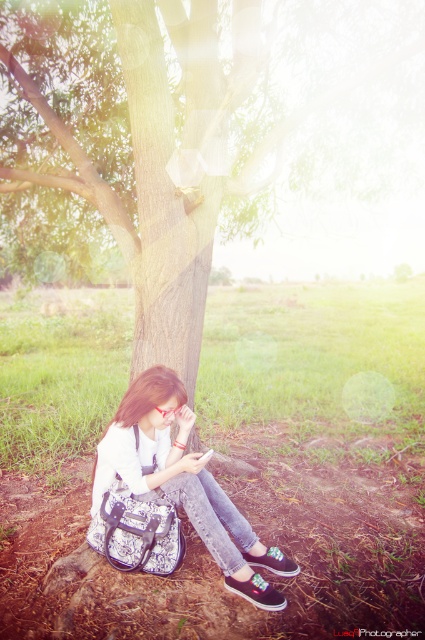
You are standing at the point marked by the coordinates point (167, 492) and want to move towards the woman. Which direction should you go?

The white textured bag at lower center is represented by point (167, 492). Since the woman is seated under a large tree in a grassy field, you should move in the direction away from the bag towards the tree to reach her.

You are a photographer trying to capture a photo of the brown rough tree trunk at left and the black canvas shoe at lower center. Which object should you zoom in on to make it appear bigger in the photo?

The brown rough tree trunk at left is larger in size than the black canvas shoe at lower center, so you should zoom in on the brown rough tree trunk at left to make it appear bigger in the photo.